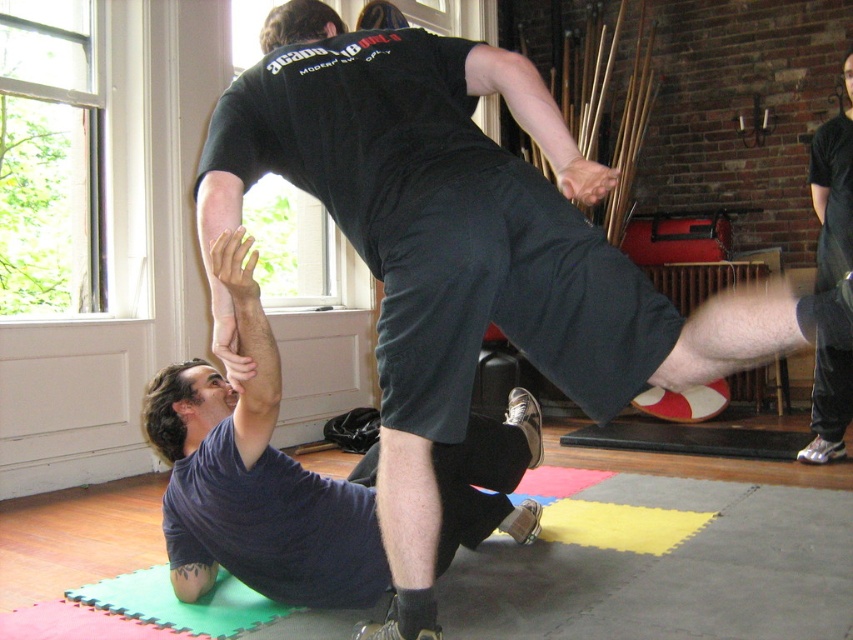
Question: Can you confirm if dark blue fabric squat at lower left is bigger than green foam yoga mat at lower left?

Choices:
 (A) yes
 (B) no

Answer: (A)

Question: Can you confirm if dark blue fabric squat at lower left is bigger than green foam yoga mat at lower left?

Choices:
 (A) yes
 (B) no

Answer: (A)

Question: Which of the following is the farthest from the observer?

Choices:
 (A) tap(235, 476)
 (B) tap(222, 580)

Answer: (B)

Question: Which point is closer to the camera taking this photo?

Choices:
 (A) (160, 618)
 (B) (518, 404)

Answer: (A)

Question: Is dark blue fabric squat at lower left bigger than green foam yoga mat at lower left?

Choices:
 (A) no
 (B) yes

Answer: (B)